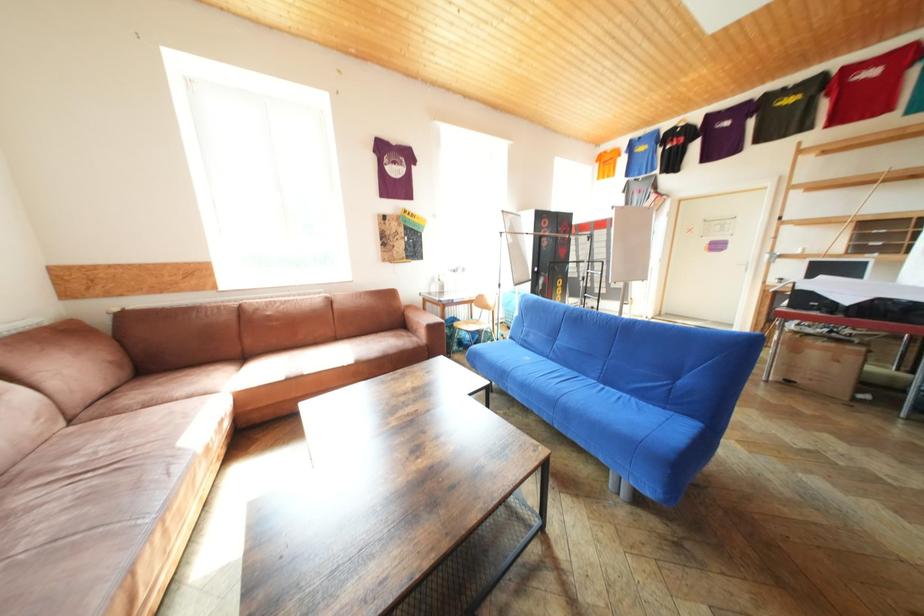
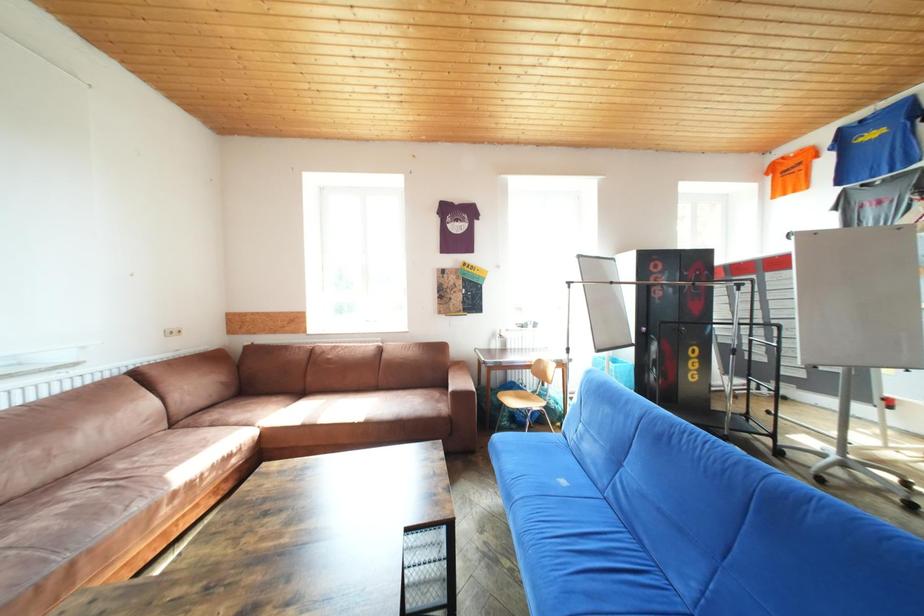
The images are taken continuously from a first-person perspective. In which direction are you moving?

The movement direction of the cameraman is right, forward.